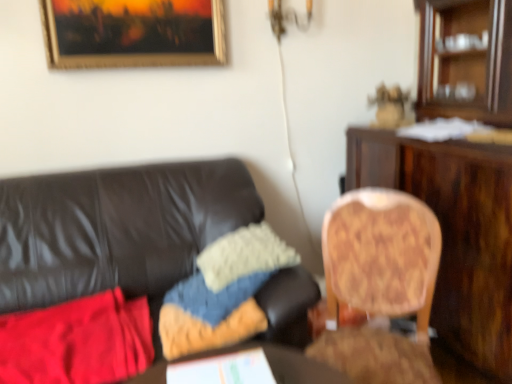
Question: From the image's perspective, is knitted fabric pillow at center, which is the 1th pillow from bottom to top, located above or below wooden desk at right?

Choices:
 (A) below
 (B) above

Answer: (A)

Question: Relative to wooden desk at right, is knitted fabric pillow at center, the 2th pillow positioned from the top, in front or behind?

Choices:
 (A) behind
 (B) front

Answer: (A)

Question: Which object is positioned closest to the wooden chair at right, arranged as the second chair when viewed from the right?

Choices:
 (A) wooden round table at center
 (B) wooden desk at right
 (C) wooden chair at right, which is the first chair in right-to-left order
 (D) gold-framed painting at upper center
 (E) knitted fabric pillow at center, which is the 1th pillow from bottom to top

Answer: (E)

Question: Which object is the farthest from the wooden chair at right, which is the first chair in right-to-left order?

Choices:
 (A) wooden cabinet at upper right
 (B) knitted fabric pillow at center, which is the 1th pillow from bottom to top
 (C) white fuzzy pillow at center, arranged as the 1th pillow when viewed from the top
 (D) red fabric at left
 (E) gold-framed painting at upper center

Answer: (E)